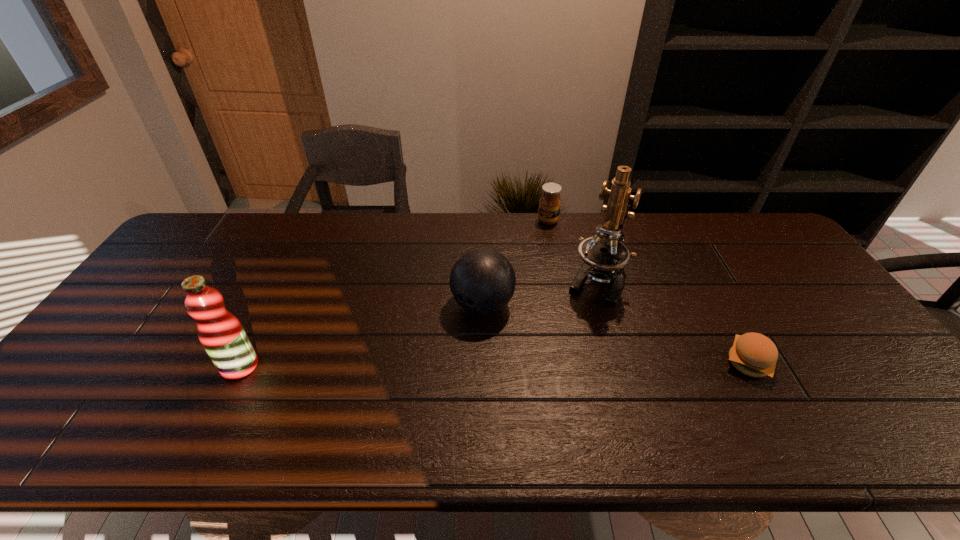
Locate an element on the screen. the leftmost object is located at coordinates (223, 337).

Identify the location of fruit juice. The height and width of the screenshot is (540, 960). (223, 337).

At what (x,y) coordinates should I click in order to perform the action: click on the rightmost object. Please return your answer as a coordinate pair (x, y). The width and height of the screenshot is (960, 540). Looking at the image, I should click on (753, 354).

Identify the location of hamburger. (753, 354).

The height and width of the screenshot is (540, 960). I want to click on microscope, so click(x=604, y=255).

This screenshot has width=960, height=540. What are the coordinates of `the fourth tallest object` in the screenshot? It's located at (549, 205).

The width and height of the screenshot is (960, 540). I want to click on honey, so click(x=549, y=205).

I want to click on bowling ball, so click(x=482, y=281).

Locate an element on the screen. the second object from left to right is located at coordinates (482, 281).

This screenshot has width=960, height=540. I want to click on free space located 0.080m on the front label of the second tallest object, so click(189, 366).